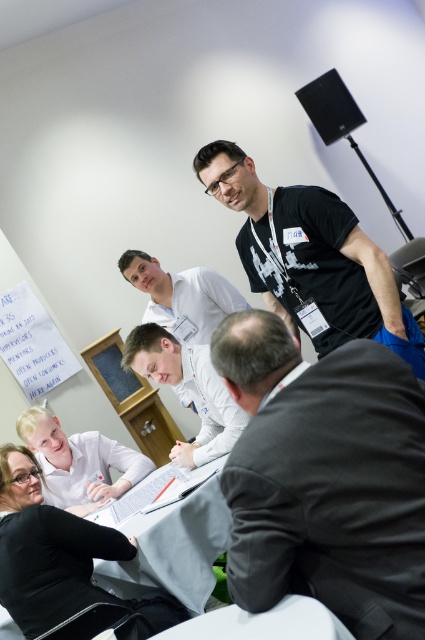
You are standing at the center of the room and want to walk to the whiteboard. There are two points marked on the floor, point A at coordinates point(25, 456) and point B at coordinates point(156, 572). Which point should you avoid stepping on to reach the whiteboard safely?

You should avoid stepping on point A at coordinates point(25, 456) because it is behind point B at coordinates point(156, 572), meaning it is farther from your current position at the center of the room. Stepping on point B would be closer to the whiteboard.